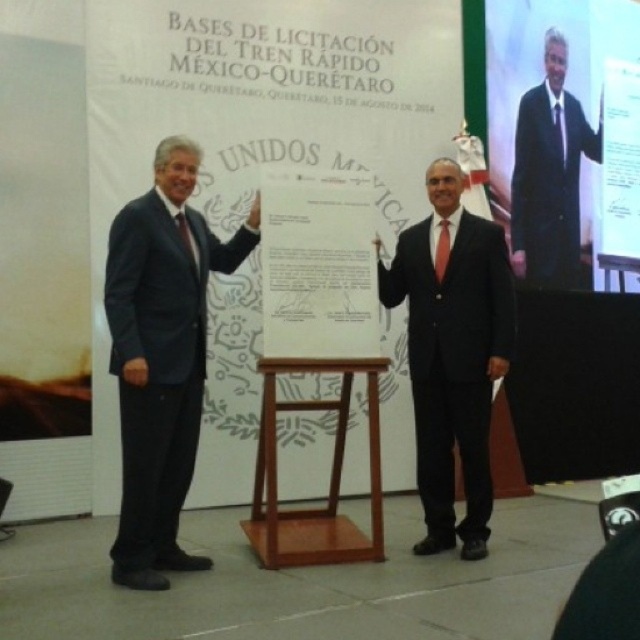
Question: Can you confirm if matte black suit at left is positioned above white paper at center?

Choices:
 (A) no
 (B) yes

Answer: (A)

Question: Which point appears farthest from the camera in this image?

Choices:
 (A) (378, 490)
 (B) (132, 477)

Answer: (A)

Question: Does matte black suit at left appear over black glossy suit at center?

Choices:
 (A) no
 (B) yes

Answer: (B)

Question: Which object appears farthest from the camera in this image?

Choices:
 (A) light brown wood stool at center
 (B) matte black suit at upper right
 (C) white paper at center

Answer: (B)

Question: Which of the following is the farthest from the observer?

Choices:
 (A) matte black suit at left
 (B) matte black hand at center
 (C) black glossy suit at center
 (D) white paper at center

Answer: (C)

Question: Considering the relative positions of white paper at center and light brown wood stool at center in the image provided, where is white paper at center located with respect to light brown wood stool at center?

Choices:
 (A) left
 (B) right

Answer: (B)